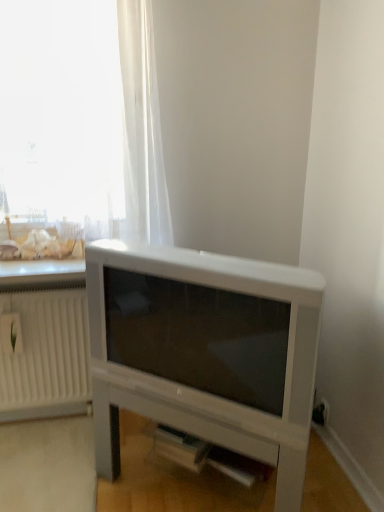
Locate an element on the screen. This screenshot has height=512, width=384. vacant area on top of white plastic radiator at left (from a real-world perspective) is located at coordinates (39, 284).